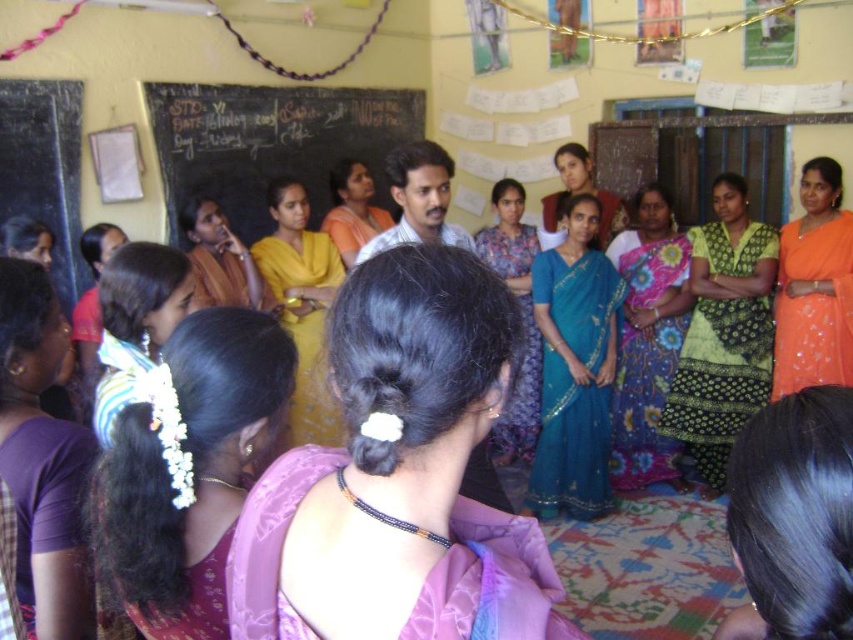
The image size is (853, 640). Describe the element at coordinates (723, 333) in the screenshot. I see `green printed saree at center` at that location.

Does green printed saree at center have a greater height compared to matte orange saree at center?

Yes, green printed saree at center is taller than matte orange saree at center.

Locate an element on the screen. The height and width of the screenshot is (640, 853). green printed saree at center is located at coordinates (723, 333).

Identify the location of black silky hair at center. (793, 518).

Which is above, black silky hair at center or matte orange saree at center?

matte orange saree at center is above.

In order to click on black silky hair at center in this screenshot , I will do (793, 518).

Is white floral hairpin at left bigger than white floral garland at left?

Incorrect, white floral hairpin at left is not larger than white floral garland at left.

From the picture: Is white floral hairpin at left above white floral garland at left?

Incorrect, white floral hairpin at left is not positioned above white floral garland at left.

Between point (120, 416) and point (161, 269), which one is positioned behind?

The point (161, 269) is more distant.

The height and width of the screenshot is (640, 853). In order to click on white floral hairpin at left in this screenshot , I will do `click(190, 468)`.